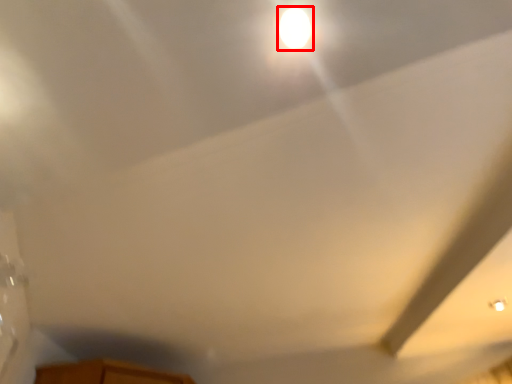
Question: In this image, where is light (annotated by the red box) located relative to exhaust hood?

Choices:
 (A) left
 (B) right

Answer: (A)